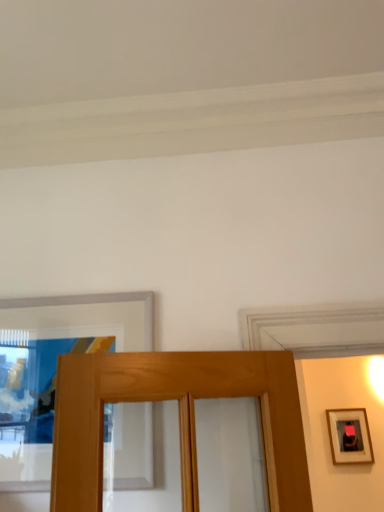
Question: From the image's perspective, is wooden picture frame at upper left, the 1th picture frame from the top, under wooden framed mirror at right, which appears as the second picture frame when viewed from the top?

Choices:
 (A) no
 (B) yes

Answer: (A)

Question: From the image's perspective, would you say wooden picture frame at upper left, the 2th picture frame from the bottom, is positioned over wooden framed mirror at right, the 2th picture frame viewed from the front?

Choices:
 (A) no
 (B) yes

Answer: (B)

Question: Can you confirm if wooden picture frame at upper left, the 2th picture frame from the bottom, is wider than wooden framed mirror at right, acting as the 1th picture frame starting from the bottom?

Choices:
 (A) yes
 (B) no

Answer: (A)

Question: Can wooden framed mirror at right, which appears as the second picture frame when viewed from the top, be found inside wooden picture frame at upper left, the 1th picture frame from the top?

Choices:
 (A) yes
 (B) no

Answer: (B)

Question: Is wooden picture frame at upper left, which is the second picture frame in right-to-left order, next to wooden framed mirror at right, acting as the 1th picture frame starting from the back, and touching it?

Choices:
 (A) no
 (B) yes

Answer: (A)

Question: Considering the relative sizes of wooden picture frame at upper left, which is the second picture frame in right-to-left order, and wooden framed mirror at right, the 2th picture frame viewed from the front, in the image provided, is wooden picture frame at upper left, which is the second picture frame in right-to-left order, shorter than wooden framed mirror at right, the 2th picture frame viewed from the front,?

Choices:
 (A) no
 (B) yes

Answer: (A)

Question: From a real-world perspective, does wooden framed mirror at right, placed as the 2th picture frame when sorted from left to right, stand above wooden picture frame at upper left, which is the second picture frame in right-to-left order?

Choices:
 (A) no
 (B) yes

Answer: (A)

Question: Is wooden picture frame at upper left, the 2th picture frame from the bottom, inside wooden framed mirror at right, which is counted as the 1th picture frame, starting from the right?

Choices:
 (A) yes
 (B) no

Answer: (B)

Question: From the image's perspective, is wooden framed mirror at right, placed as the 2th picture frame when sorted from left to right, above wooden picture frame at upper left, the 1th picture frame from the top?

Choices:
 (A) yes
 (B) no

Answer: (B)

Question: Can you confirm if wooden framed mirror at right, which is counted as the 1th picture frame, starting from the right, is wider than wooden picture frame at upper left, which is the 1th picture frame from left to right?

Choices:
 (A) no
 (B) yes

Answer: (A)

Question: Is wooden framed mirror at right, acting as the 1th picture frame starting from the bottom, positioned far away from wooden picture frame at upper left, which is the 1th picture frame from left to right?

Choices:
 (A) yes
 (B) no

Answer: (A)

Question: Considering the relative sizes of wooden framed mirror at right, which is counted as the 1th picture frame, starting from the right, and wooden picture frame at upper left, the first picture frame positioned from the front, in the image provided, is wooden framed mirror at right, which is counted as the 1th picture frame, starting from the right, smaller than wooden picture frame at upper left, the first picture frame positioned from the front,?

Choices:
 (A) yes
 (B) no

Answer: (A)

Question: Is wooden picture frame at upper left, the 2th picture frame from the bottom, bigger or smaller than wooden framed mirror at right, the 2th picture frame viewed from the front?

Choices:
 (A) small
 (B) big

Answer: (B)